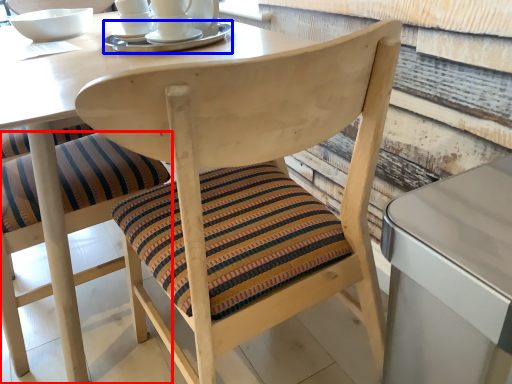
Question: Which object appears closest to the camera in this image, chair (highlighted by a red box) or tableware (highlighted by a blue box)?

Choices:
 (A) chair
 (B) tableware

Answer: (A)